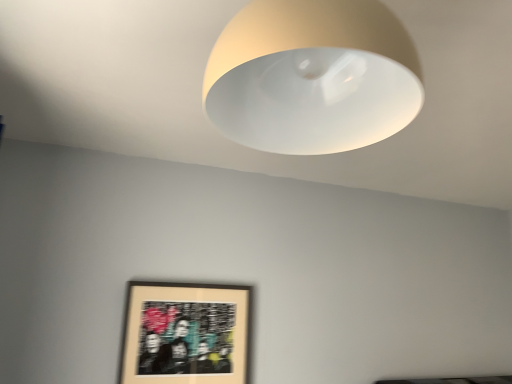
Question: From a real-world perspective, is matte white lampshade at upper center on top of matte black picture frame at lower left?

Choices:
 (A) yes
 (B) no

Answer: (A)

Question: Does matte white lampshade at upper center appear on the left side of matte black picture frame at lower left?

Choices:
 (A) yes
 (B) no

Answer: (B)

Question: Considering the relative sizes of matte white lampshade at upper center and matte black picture frame at lower left in the image provided, is matte white lampshade at upper center bigger than matte black picture frame at lower left?

Choices:
 (A) no
 (B) yes

Answer: (B)

Question: Does matte white lampshade at upper center have a greater height compared to matte black picture frame at lower left?

Choices:
 (A) no
 (B) yes

Answer: (A)

Question: Can you see matte white lampshade at upper center touching matte black picture frame at lower left?

Choices:
 (A) yes
 (B) no

Answer: (B)

Question: Is matte white lampshade at upper center not near matte black picture frame at lower left?

Choices:
 (A) no
 (B) yes

Answer: (B)

Question: Is matte black picture frame at lower left with matte white lampshade at upper center?

Choices:
 (A) yes
 (B) no

Answer: (B)

Question: From the image's perspective, is matte black picture frame at lower left on matte white lampshade at upper center?

Choices:
 (A) yes
 (B) no

Answer: (B)

Question: Is matte black picture frame at lower left behind matte white lampshade at upper center?

Choices:
 (A) no
 (B) yes

Answer: (B)

Question: Does matte black picture frame at lower left have a lesser height compared to matte white lampshade at upper center?

Choices:
 (A) no
 (B) yes

Answer: (A)

Question: Can we say matte black picture frame at lower left lies outside matte white lampshade at upper center?

Choices:
 (A) no
 (B) yes

Answer: (B)

Question: Is matte black picture frame at lower left at the right side of matte white lampshade at upper center?

Choices:
 (A) yes
 (B) no

Answer: (B)

Question: Is matte black picture frame at lower left to the left or to the right of matte white lampshade at upper center in the image?

Choices:
 (A) left
 (B) right

Answer: (A)